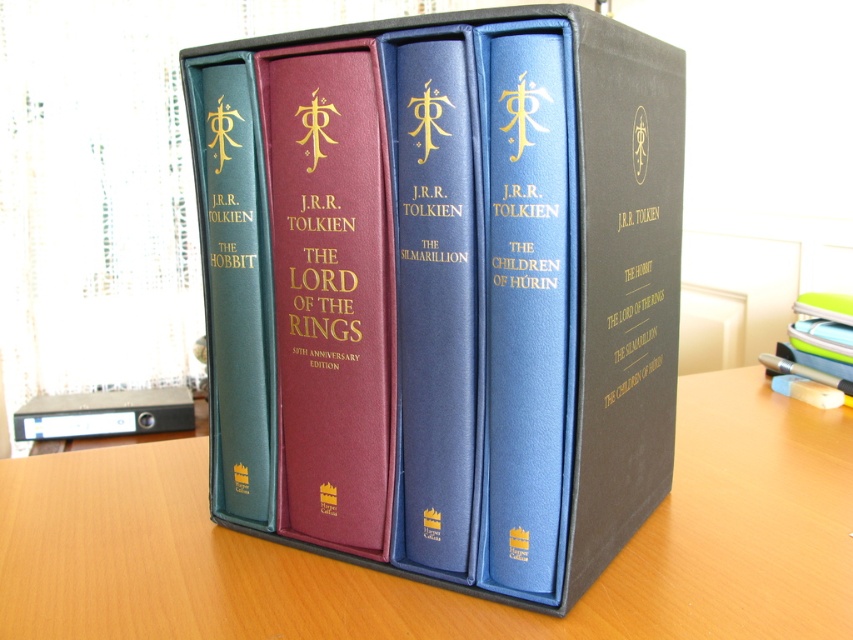
Question: Which of these objects is positioned closest to the matte gold text at center?

Choices:
 (A) goldmaterial/texturetitle at center
 (B) wooden table at center
 (C) black leather spine at center
 (D) maroon leather book at center

Answer: (C)

Question: Among these points, which one is nearest to the camera?

Choices:
 (A) (239, 212)
 (B) (625, 228)
 (C) (614, 324)
 (D) (616, 632)

Answer: (D)

Question: Does goldmaterial/texturetitle at center appear under matte black text at left?

Choices:
 (A) yes
 (B) no

Answer: (A)

Question: Which of the following is the farthest from the observer?

Choices:
 (A) (285, 88)
 (B) (305, 250)
 (C) (184, 492)

Answer: (C)

Question: Is goldmaterial/texturetitle at center below black leather spine at center?

Choices:
 (A) no
 (B) yes

Answer: (A)

Question: Can you confirm if wooden table at center is smaller than maroon leather book at center?

Choices:
 (A) yes
 (B) no

Answer: (B)